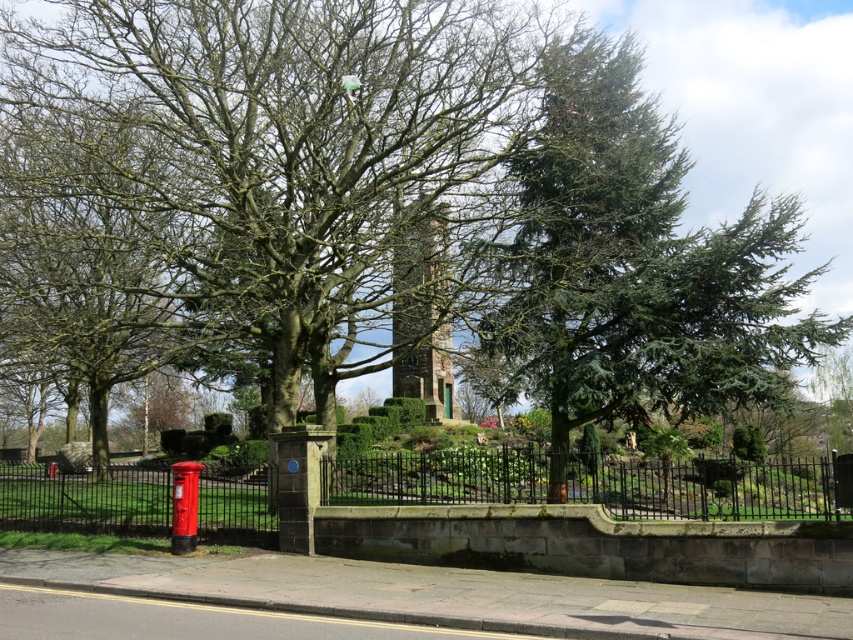
How distant is green needle-like tree at upper right from glossy metal fence at lower center?

green needle-like tree at upper right is 5.83 meters away from glossy metal fence at lower center.

Between green needle-like tree at upper right and glossy metal fence at lower center, which one appears on the right side from the viewer's perspective?

Positioned to the right is green needle-like tree at upper right.

Is point (527, 163) behind point (129, 490)?

No, (527, 163) is in front of (129, 490).

Locate an element on the screen. The image size is (853, 640). green needle-like tree at upper right is located at coordinates (637, 264).

Does green textured tree at center have a greater width compared to green needle-like tree at upper right?

Incorrect, green textured tree at center's width does not surpass green needle-like tree at upper right's.

Is point (372, 234) positioned before point (561, 321)?

Yes, it is.

What are the coordinates of `green textured tree at center` in the screenshot? It's located at (281, 148).

Is green textured tree at center taller than glossy metal fence at lower center?

Yes.

Is green textured tree at center to the left of glossy metal fence at lower center from the viewer's perspective?

Correct, you'll find green textured tree at center to the left of glossy metal fence at lower center.

Does point (421, 204) come behind point (401, 483)?

No, (421, 204) is in front of (401, 483).

The width and height of the screenshot is (853, 640). Find the location of `green textured tree at center`. green textured tree at center is located at coordinates (281, 148).